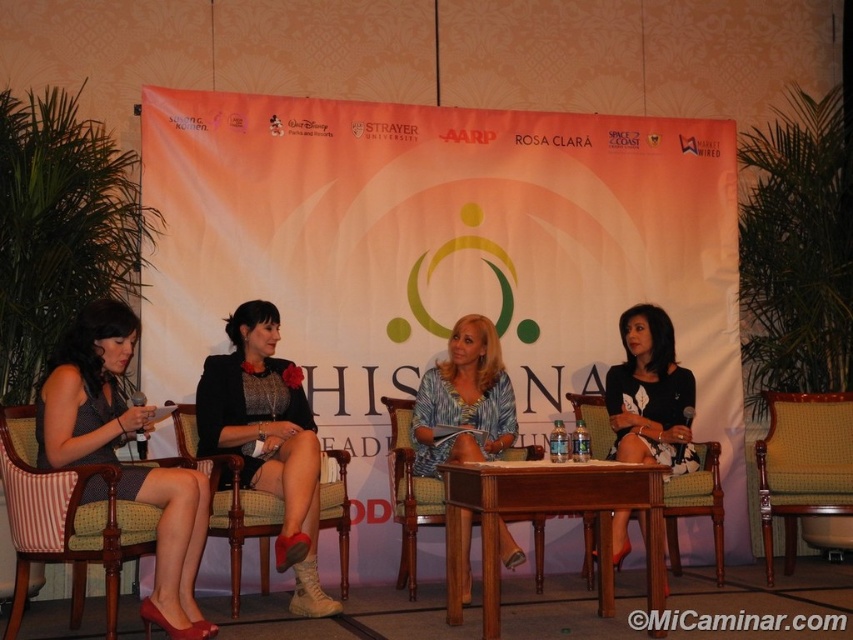
You are standing at the back of the room facing the panel discussion. There are two points marked on the floor in front of you. The first point is at coordinates point (x=450, y=522) and the second is at point (x=706, y=449). Which point is closer to you?

Point (x=706, y=449) is further back than point (x=450, y=522), so the closer point to you is point (x=450, y=522).

You are an event organizer checking the setup. You need to place a tall decorative plant between the wooden at center and the green striped fabric chair at center. Which object should the plant be placed closer to?

The wooden at center is not as tall as the green striped fabric chair at center, so the plant should be placed closer to the wooden at center to maintain visual balance.